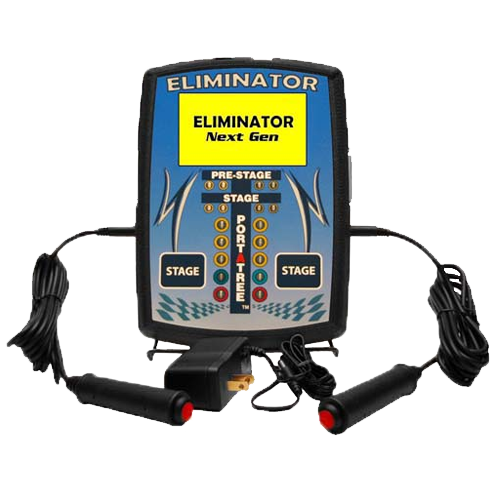
The width and height of the screenshot is (500, 500). Find the location of `handles`. handles is located at coordinates (389, 396), (103, 389).